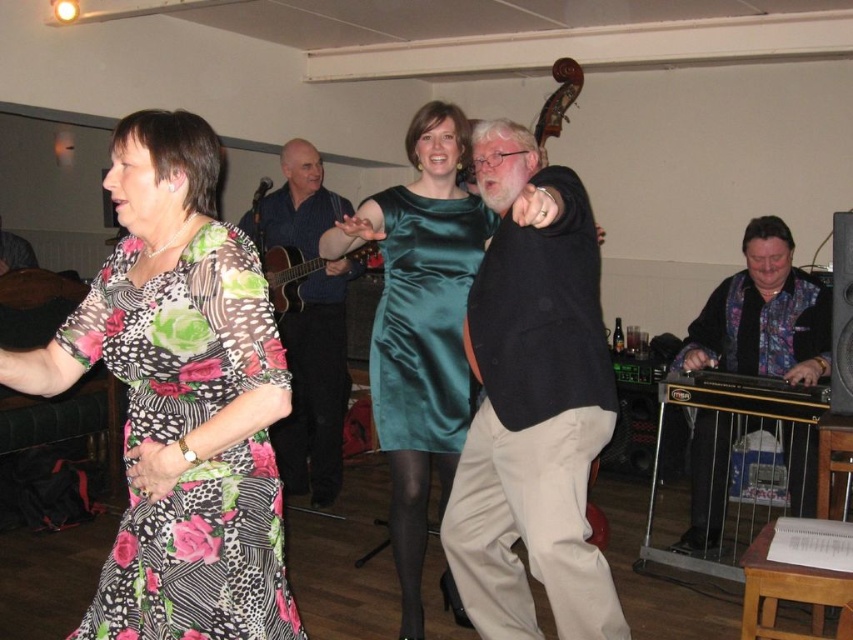
You are standing at the center of the room and want to move to the floral print fabric dress at left. Which direction should you move in?

You should move to the left to reach the floral print fabric dress at left since it is positioned at point 0.872 on the x axis, which is to the left of the center.

You are at a party and see two people dancing. The first person is wearing a floral print fabric dress at left, and the second is wearing a blue shirt at center. Which one has a larger clothing item?

The blue shirt at center is larger than the floral print fabric dress at left.